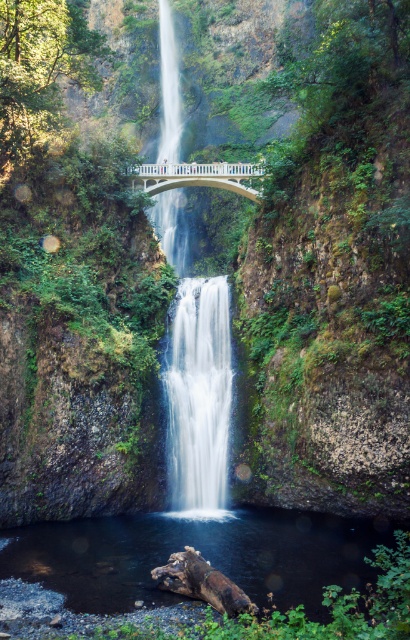
Between smooth brown log at lower center and white concrete bridge at center, which one has less height?

With less height is smooth brown log at lower center.

From the picture: Can you confirm if smooth brown log at lower center is positioned to the right of white concrete bridge at center?

Indeed, smooth brown log at lower center is positioned on the right side of white concrete bridge at center.

Who is more forward, (x=243, y=508) or (x=241, y=170)?

Point (x=243, y=508)

Find the location of a particular element. smooth brown log at lower center is located at coordinates coord(202,554).

Is smooth brown log at lower center bigger than white smooth waterfall at center?

No, smooth brown log at lower center is not bigger than white smooth waterfall at center.

Measure the distance between smooth brown log at lower center and white smooth waterfall at center.

A distance of 12.37 meters exists between smooth brown log at lower center and white smooth waterfall at center.

Does point (268, 604) lie behind point (216, 451)?

That is False.

The height and width of the screenshot is (640, 410). I want to click on smooth brown log at lower center, so click(x=202, y=554).

Can you confirm if white smooth waterfall at center is bigger than white concrete bridge at center?

Indeed, white smooth waterfall at center has a larger size compared to white concrete bridge at center.

Measure the distance between point (209, 468) and camera.

Point (209, 468) and camera are 52.31 meters apart.

Is point (175, 372) more distant than point (241, 186)?

That is False.

This screenshot has width=410, height=640. Identify the location of white smooth waterfall at center. (198, 396).